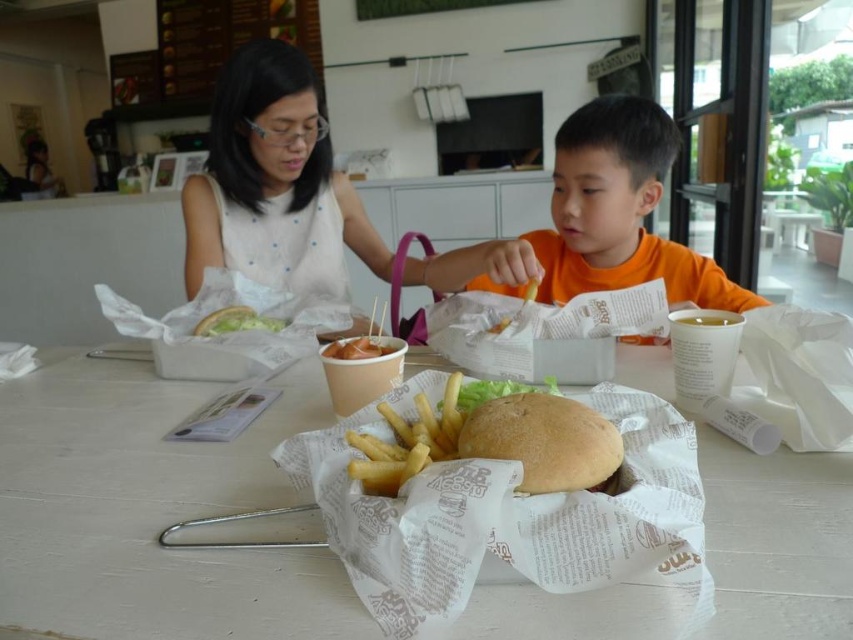
From the picture: Who is more distant from viewer, (578, 140) or (604, 460)?

Point (578, 140)

Does orange matte shirt at center appear under bread-like bun at center?

Incorrect, orange matte shirt at center is not positioned below bread-like bun at center.

Which is behind, point (630, 221) or point (605, 472)?

The point (630, 221) is more distant.

The image size is (853, 640). I want to click on orange matte shirt at center, so 619,211.

Who is positioned more to the left, bread-like bun at center or white paper burger at upper left?

white paper burger at upper left

Is the position of bread-like bun at center less distant than that of white paper burger at upper left?

Yes, bread-like bun at center is closer to the viewer.

Does point (538, 460) lie in front of point (276, 321)?

Yes.

Image resolution: width=853 pixels, height=640 pixels. What are the coordinates of `bread-like bun at center` in the screenshot? It's located at (x=543, y=440).

Does white paper basket at center appear on the left side of yellowish matte chicken at center?

Yes, white paper basket at center is to the left of yellowish matte chicken at center.

Which is more to the left, white paper basket at center or yellowish matte chicken at center?

From the viewer's perspective, white paper basket at center appears more on the left side.

Who is more forward, (276, 504) or (349, 349)?

Point (276, 504) is more forward.

This screenshot has height=640, width=853. What are the coordinates of `white paper basket at center` in the screenshot? It's located at (149, 512).